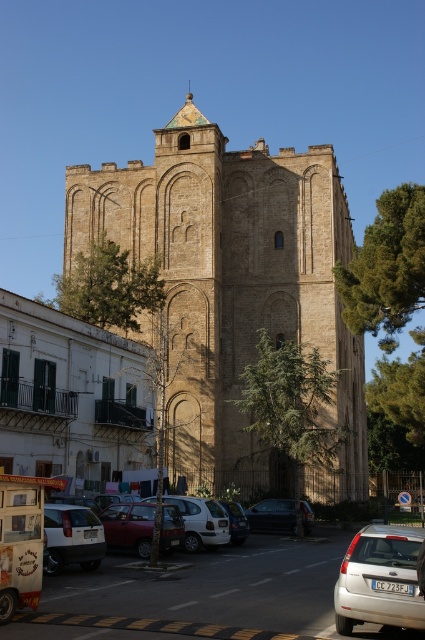
Consider the image. You are a delivery driver needing to park your 5.5 meter long truck between the white matte hatchback at lower right and the white matte car at lower left. Can you fit your truck in the space between them without moving either vehicle?

The distance between the white matte hatchback at lower right and the white matte car at lower left is 15.65 meters. Since your truck is only 5.5 meters long, there is more than enough space to park it between them without moving either vehicle.

You are a delivery person needing to park your vehicle in the area shown. You see the white matte hatchback at lower right and the dark gray metallic car at center. Which car is closer to the street in front of the historic building?

The white matte hatchback at lower right is closer to the street in front of the historic building because it is positioned in front of the dark gray metallic car at center.

You are a pedestrian standing on the paved street in front of the historic stone building. You need to cross the street to reach the smaller white residential building with green shutters. Which car, the white matte hatchback at lower right or the white matte car at lower left, is closer to your current position?

The white matte hatchback at lower right is closer to your current position because it is nearer to the viewer than the white matte car at lower left.